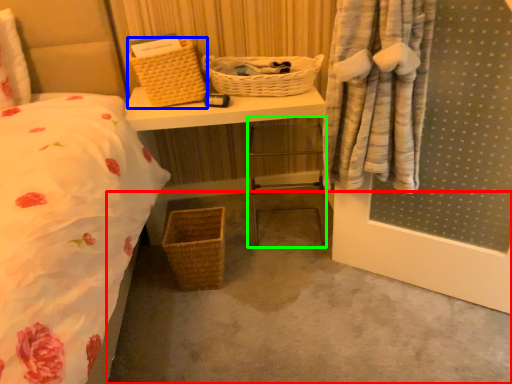
Question: Estimate the real-world distances between objects in this image. Which object is closer to concrete (highlighted by a red box), picnic basket (highlighted by a blue box) or chair (highlighted by a green box)?

Choices:
 (A) picnic basket
 (B) chair

Answer: (B)